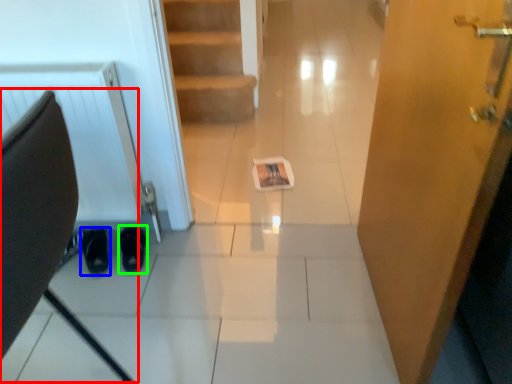
Question: Which is nearer to the swivel chair (highlighted by a red box)? footwear (highlighted by a blue box) or footwear (highlighted by a green box).

Choices:
 (A) footwear
 (B) footwear

Answer: (B)